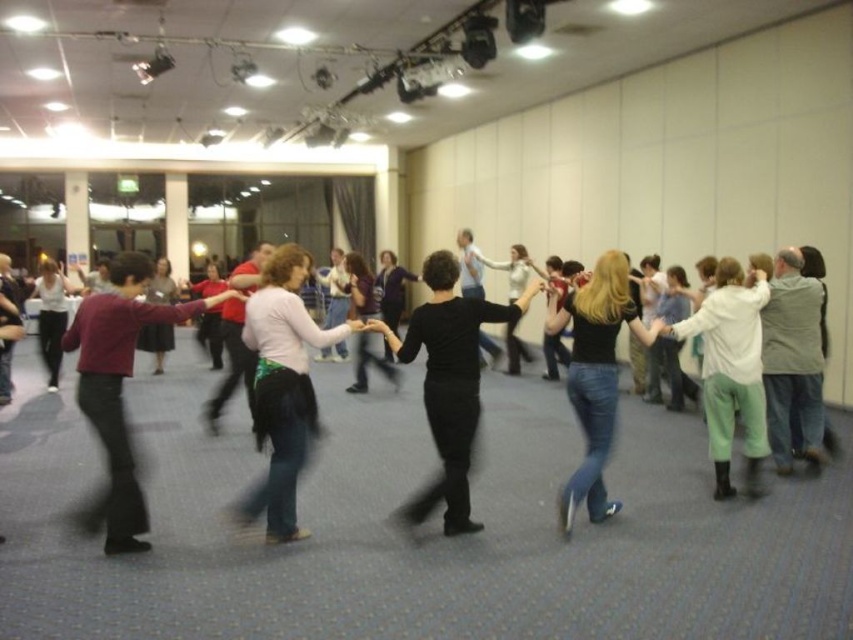
Question: Does maroon sweater at left lie in front of black matte dress at center?

Choices:
 (A) no
 (B) yes

Answer: (B)

Question: Which point is farther from the camera taking this photo?

Choices:
 (A) (49, 269)
 (B) (264, 486)

Answer: (A)

Question: Which point is farther from the camera taking this photo?

Choices:
 (A) (57, 371)
 (B) (97, 301)
 (C) (451, 417)
 (D) (636, 332)

Answer: (A)

Question: Can you confirm if black matte dress at center is wider than matte white blouse at center?

Choices:
 (A) no
 (B) yes

Answer: (B)

Question: From the image, what is the correct spatial relationship of maroon sweater at left in relation to matte white blouse at center?

Choices:
 (A) below
 (B) above

Answer: (A)

Question: Among these objects, which one is farthest from the camera?

Choices:
 (A) jeans at center
 (B) white matte skirt at center

Answer: (A)